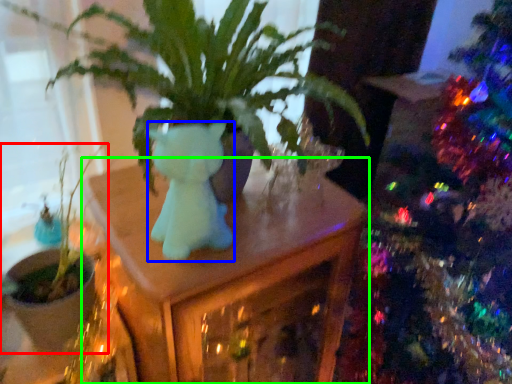
Question: Which object is the farthest from houseplant (highlighted by a red box)? Choose among these: animal (highlighted by a blue box) or table (highlighted by a green box).

Choices:
 (A) animal
 (B) table

Answer: (A)